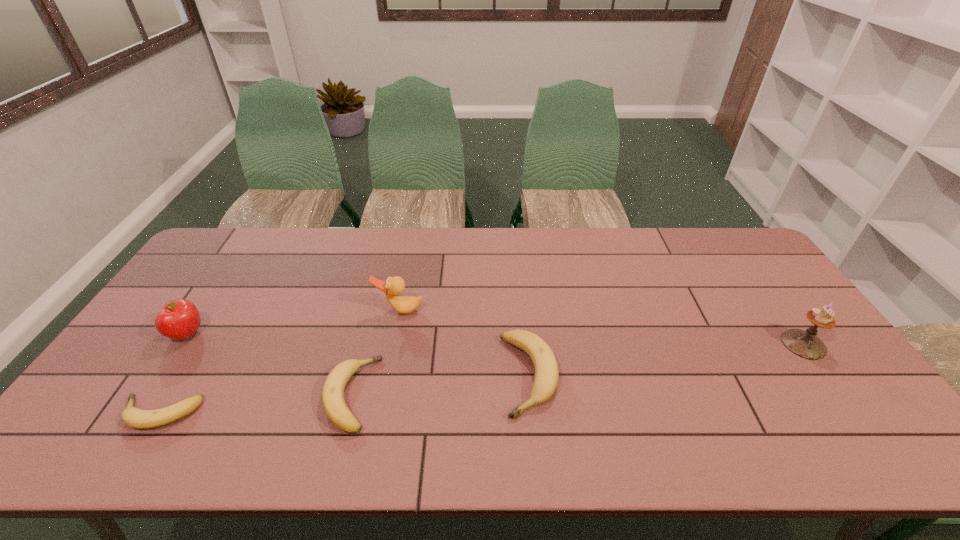
Identify the location of vacant place for an extra banana on the right. (694, 358).